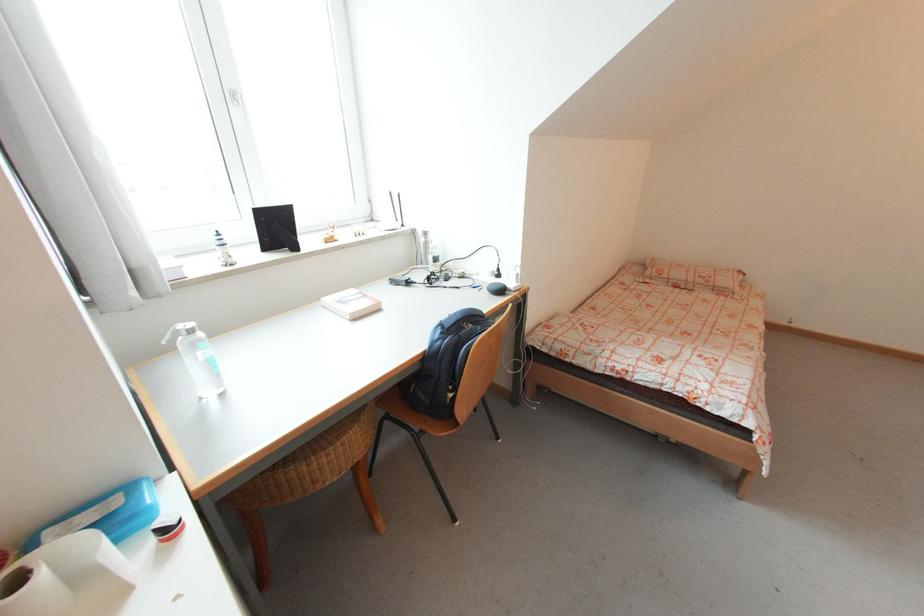
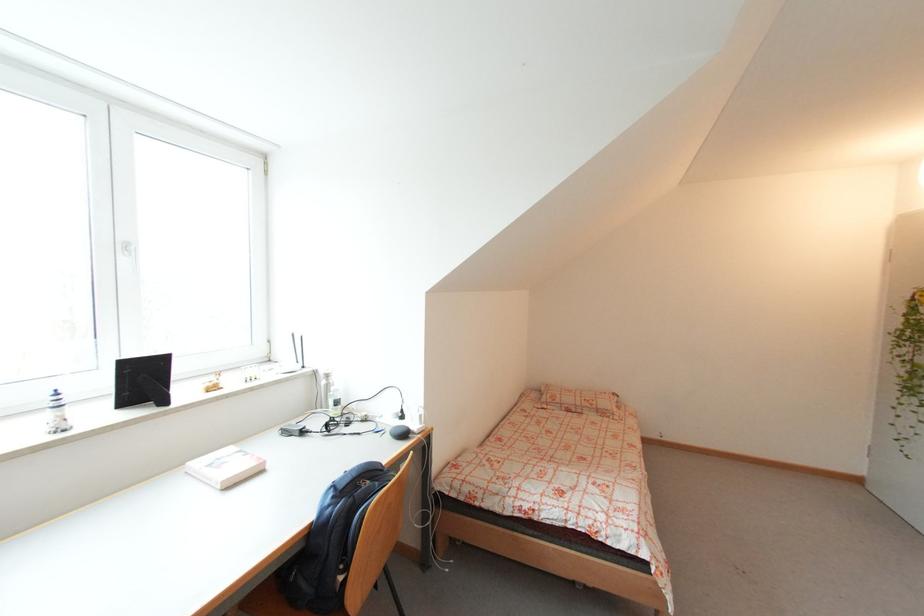
The point at [239,103] is marked in the first image. Where is the corresponding point in the second image?

(130, 253)